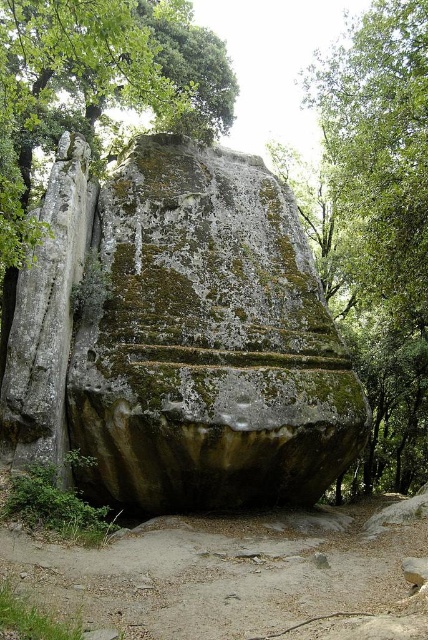
Can you confirm if green mossy rock at center is bigger than green mossy rock at upper center?

Yes.

Does point (275, 308) come in front of point (145, 49)?

No, it is behind (145, 49).

Is point (201, 460) positioned before point (130, 16)?

No, (201, 460) is further to viewer.

The image size is (428, 640). Find the location of `green mossy rock at center`. green mossy rock at center is located at coordinates (178, 337).